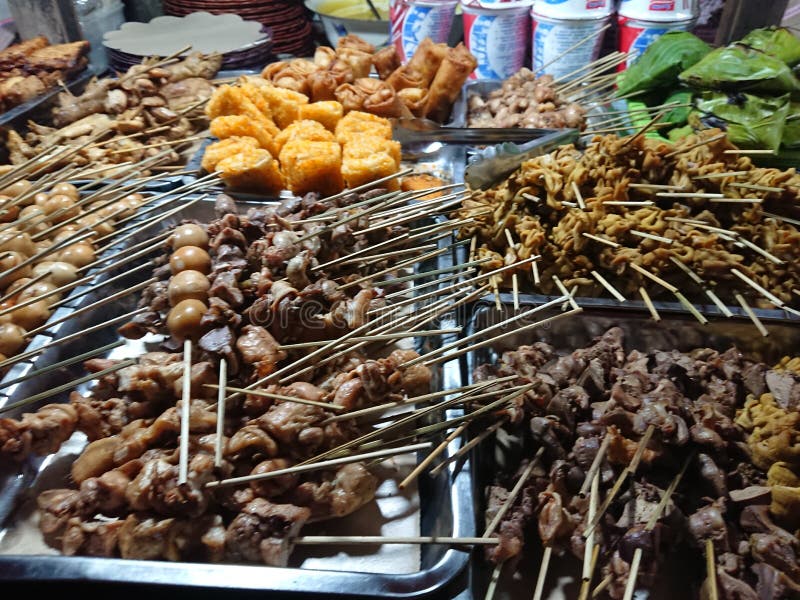
Where is `bowl`? The width and height of the screenshot is (800, 600). bowl is located at coordinates (352, 9).